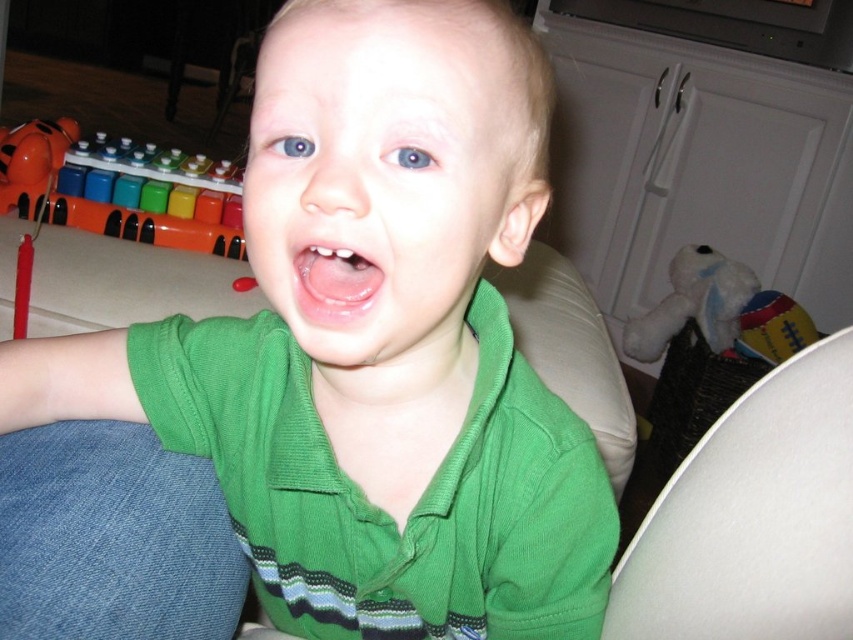
Between white plush bear at right and blue matte eye at center, which one appears on the left side from the viewer's perspective?

Positioned to the left is blue matte eye at center.

Does point (689, 252) lie in front of point (294, 140)?

No.

Is point (679, 260) positioned before point (276, 148)?

No, (679, 260) is behind (276, 148).

Locate an element on the screen. white plush bear at right is located at coordinates (718, 310).

Can you confirm if white plush bear at right is shorter than pink glossy tongue at center?

No, white plush bear at right is not shorter than pink glossy tongue at center.

Does white plush bear at right appear on the right side of pink glossy tongue at center?

Yes, white plush bear at right is to the right of pink glossy tongue at center.

Which is behind, point (751, 300) or point (339, 250)?

The point (751, 300) is more distant.

Find the location of a particular element. white plush bear at right is located at coordinates (718, 310).

The height and width of the screenshot is (640, 853). What do you see at coordinates (410, 157) in the screenshot?
I see `blue matte eye at upper center` at bounding box center [410, 157].

I want to click on blue matte eye at upper center, so click(410, 157).